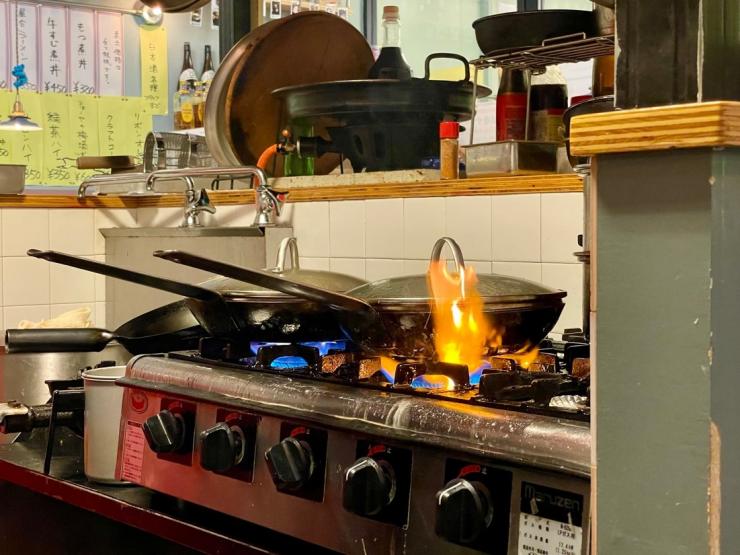
At what (x,y) coordinates should I click in order to perform the action: click on knobs. Please return your answer as a coordinate pair (x, y). This screenshot has width=740, height=555. Looking at the image, I should click on (456, 494), (356, 474), (297, 459), (212, 435), (158, 428).